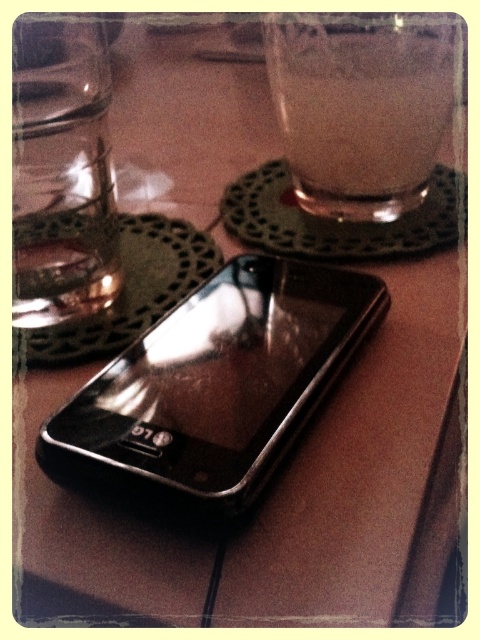
Question: Is black glossy smartphone at center closer to camera compared to transparent glass at upper center?

Choices:
 (A) no
 (B) yes

Answer: (B)

Question: Among these objects, which one is nearest to the camera?

Choices:
 (A) transparent glass at upper center
 (B) black glossy smartphone at center

Answer: (B)

Question: Which object is closer to the camera taking this photo?

Choices:
 (A) transparent glass at upper center
 (B) black glossy smartphone at center

Answer: (B)

Question: Can you confirm if black glossy smartphone at center is bigger than transparent glass at upper center?

Choices:
 (A) yes
 (B) no

Answer: (A)

Question: Does black glossy smartphone at center appear over transparent glass at upper center?

Choices:
 (A) no
 (B) yes

Answer: (A)